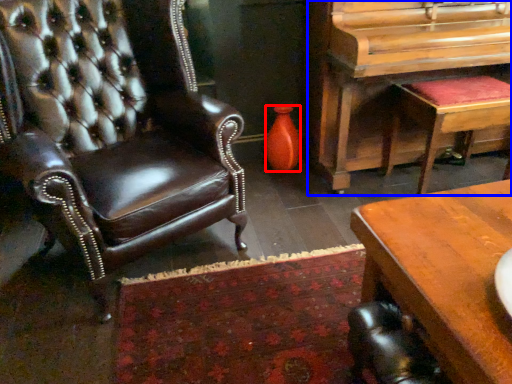
Question: Which of the following is the farthest to the observer, vase (highlighted by a red box) or piano (highlighted by a blue box)?

Choices:
 (A) vase
 (B) piano

Answer: (A)